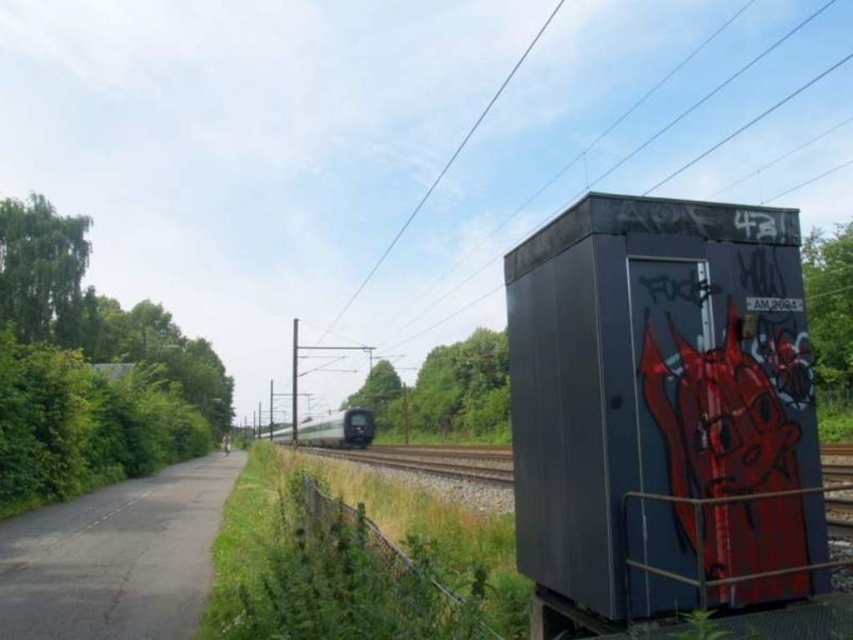
Does smooth metal train track at center lie in front of silver metallic train at center?

Yes.

This screenshot has height=640, width=853. Describe the element at coordinates (434, 460) in the screenshot. I see `smooth metal train track at center` at that location.

Find the location of a particular element. smooth metal train track at center is located at coordinates (434, 460).